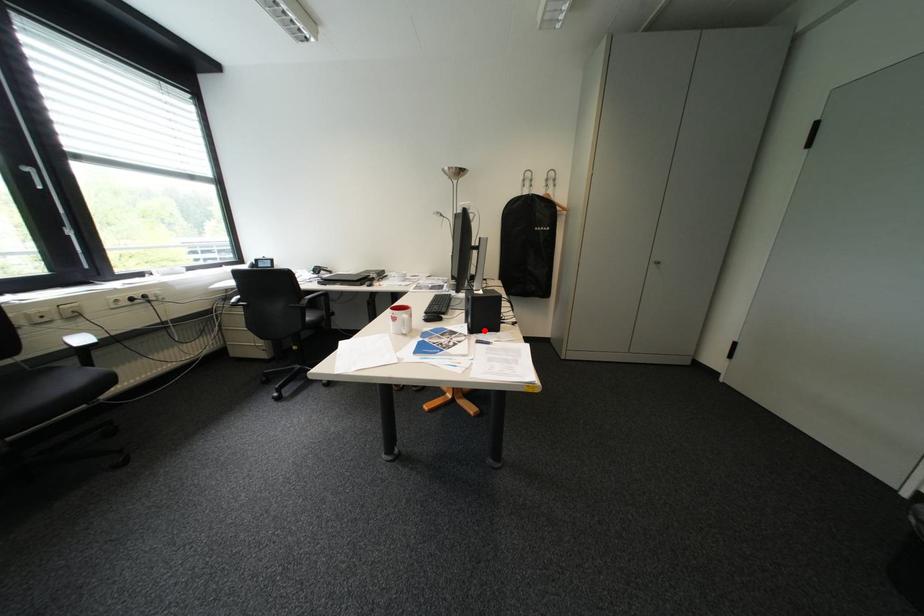
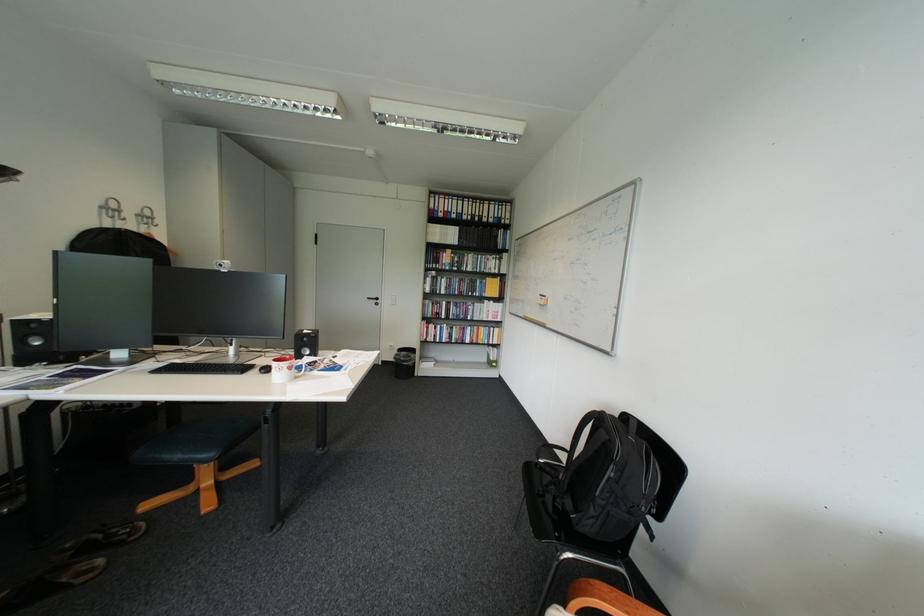
Question: I am providing you with two images of the same scene from different viewpoints. A red point is marked on the first image. Is the red point's position out of view in image 2?

Choices:
 (A) Yes
 (B) No

Answer: (A)